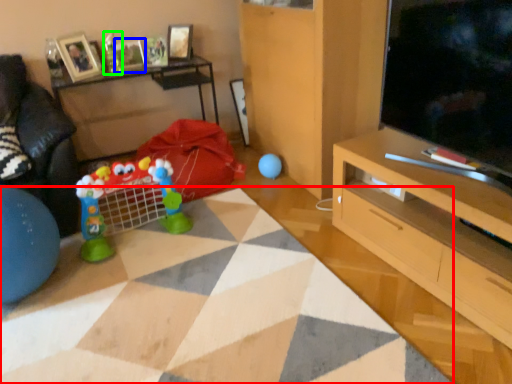
Question: Considering the real-world distances, which object is farthest from plain (highlighted by a red box)? picture frame (highlighted by a blue box) or toy (highlighted by a green box)?

Choices:
 (A) picture frame
 (B) toy

Answer: (A)